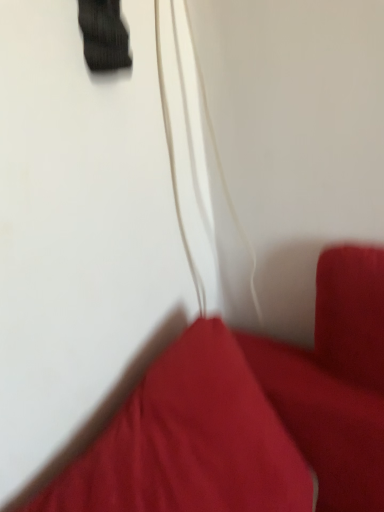
Identify the location of white matte string at center. (175, 170).

The height and width of the screenshot is (512, 384). What do you see at coordinates (175, 170) in the screenshot?
I see `white matte string at center` at bounding box center [175, 170].

Where is `matte red pillow at lower right`? This screenshot has height=512, width=384. matte red pillow at lower right is located at coordinates (252, 414).

Describe the element at coordinates (252, 414) in the screenshot. I see `matte red pillow at lower right` at that location.

I want to click on white matte string at center, so click(175, 170).

Between white matte string at center and matte red pillow at lower right, which one appears on the left side from the viewer's perspective?

matte red pillow at lower right.

Is the position of white matte string at center more distant than that of matte red pillow at lower right?

Yes, the depth of white matte string at center is greater than that of matte red pillow at lower right.

Is point (252, 276) in front of point (381, 296)?

No, it is not.

From the image's perspective, is white matte string at center on top of matte red pillow at lower right?

Yes.

From a real-world perspective, is white matte string at center on matte red pillow at lower right?

Yes, from a real-world perspective, white matte string at center is on top of matte red pillow at lower right.

Based on the photo, is white matte string at center thinner than matte red pillow at lower right?

Correct, the width of white matte string at center is less than that of matte red pillow at lower right.

Considering the relative sizes of white matte string at center and matte red pillow at lower right in the image provided, is white matte string at center shorter than matte red pillow at lower right?

Incorrect, the height of white matte string at center does not fall short of that of matte red pillow at lower right.

Based on their sizes in the image, would you say white matte string at center is bigger or smaller than matte red pillow at lower right?

In the image, white matte string at center appears to be smaller than matte red pillow at lower right.

Is white matte string at center situated inside matte red pillow at lower right or outside?

The correct answer is: outside.

Is white matte string at center in contact with matte red pillow at lower right?

No, white matte string at center is not with matte red pillow at lower right.

Could you tell me if white matte string at center is facing matte red pillow at lower right?

No.

Based on the photo, how many degrees apart are the facing directions of white matte string at center and matte red pillow at lower right?

white matte string at center and matte red pillow at lower right are facing 7.64 degrees away from each other.

How much distance is there between white matte string at center and matte red pillow at lower right?

white matte string at center and matte red pillow at lower right are 12.79 inches apart.

The width and height of the screenshot is (384, 512). What are the coordinates of `furniture below the white matte string at center (from the image's perspective)` in the screenshot? It's located at (252, 414).

Based on their positions, is matte red pillow at lower right located to the left or right of white matte string at center?

matte red pillow at lower right is to the left of white matte string at center.

Is matte red pillow at lower right in front of or behind white matte string at center in the image?

matte red pillow at lower right is positioned closer to the viewer than white matte string at center.

Is point (302, 387) farther from viewer compared to point (167, 105)?

Yes, point (302, 387) is farther from viewer.

From the image's perspective, is matte red pillow at lower right above or below white matte string at center?

Based on their image positions, matte red pillow at lower right is located beneath white matte string at center.

From a real-world perspective, who is located higher, matte red pillow at lower right or white matte string at center?

In real-world perspective, white matte string at center is above.

Is matte red pillow at lower right thinner than white matte string at center?

No, matte red pillow at lower right is not thinner than white matte string at center.

Does matte red pillow at lower right have a greater height compared to white matte string at center?

Incorrect, the height of matte red pillow at lower right is not larger of that of white matte string at center.

Considering the relative sizes of matte red pillow at lower right and white matte string at center in the image provided, is matte red pillow at lower right smaller than white matte string at center?

No.

Is matte red pillow at lower right inside the boundaries of white matte string at center, or outside?

matte red pillow at lower right is located beyond the bounds of white matte string at center.

Is matte red pillow at lower right far away from white matte string at center?

No, matte red pillow at lower right is in close proximity to white matte string at center.

Is matte red pillow at lower right aimed at white matte string at center?

No.

The width and height of the screenshot is (384, 512). I want to click on string that appears above the matte red pillow at lower right (from the image's perspective), so click(x=175, y=170).

The image size is (384, 512). I want to click on string located above the matte red pillow at lower right (from the image's perspective), so click(x=175, y=170).

Locate an element on the screen. The width and height of the screenshot is (384, 512). string behind the matte red pillow at lower right is located at coordinates (175, 170).